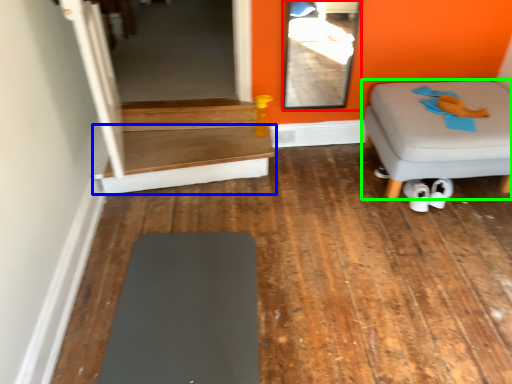
Question: Considering the real-world distances, which object is closest to glass door (highlighted by a red box)? table (highlighted by a blue box) or furniture (highlighted by a green box).

Choices:
 (A) table
 (B) furniture

Answer: (B)